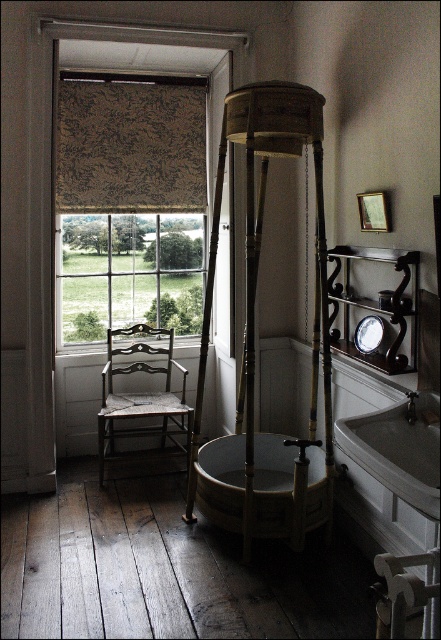
You are standing in the vintage bathroom and want to move from the wooden chair at left to the window to open the brown textured curtain at upper left. Which object do you need to step over or around first?

You need to step over or around the brown textured curtain at upper left first because the wooden chair at left is behind it, meaning the curtain is closer to you in this scenario.

You are designing a layout for a vintage bathroom and need to place the brown textured curtain at upper left and the wooden chair at left. Considering their sizes, which object should be placed closer to the entrance to ensure there is enough space for movement?

The brown textured curtain at upper left is smaller than the wooden chair at left. To ensure enough space for movement, the smaller brown textured curtain at upper left should be placed closer to the entrance, while the larger wooden chair at left can be positioned further away.

You are designing a layout for a vintage bathroom and have a textured beige fabric at upper left and a wooden chair at left. Which object occupies more space in the image?

The textured beige fabric at upper left is bigger than the wooden chair at left, so it occupies more space in the image.